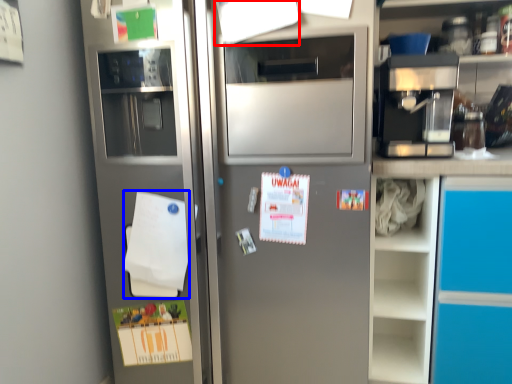
Question: Which point is closer to the camera, paper (highlighted by a red box) or notepad (highlighted by a blue box)?

Choices:
 (A) paper
 (B) notepad

Answer: (A)